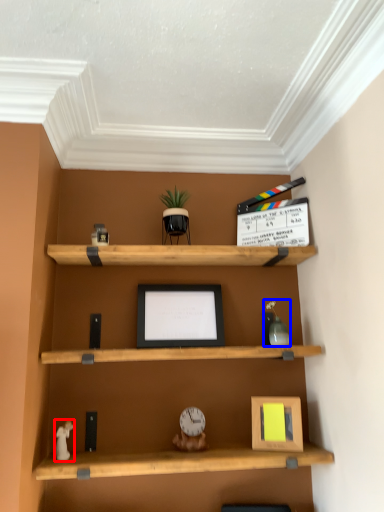
Question: Which of the following is the closest to the observer, toy (highlighted by a red box) or toy (highlighted by a blue box)?

Choices:
 (A) toy
 (B) toy

Answer: (A)